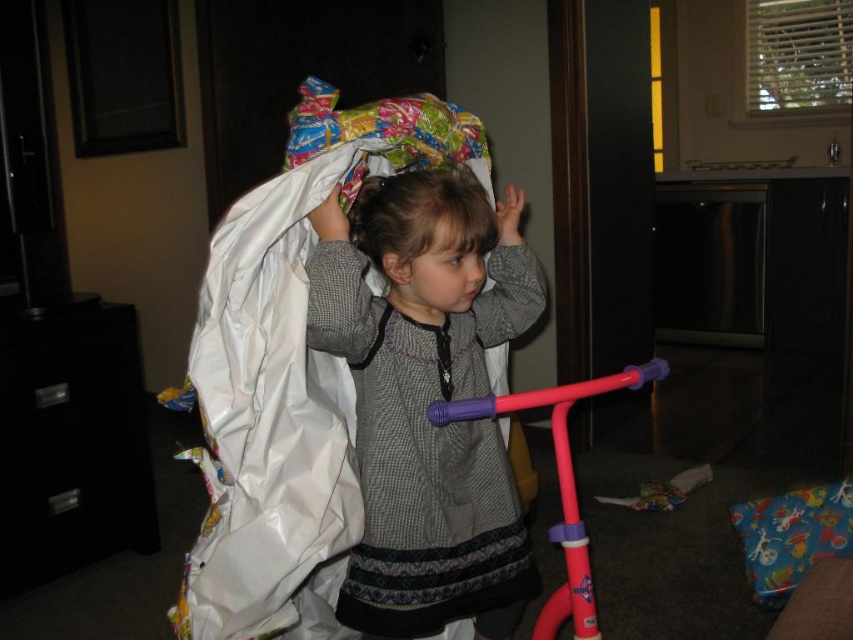
Question: Can you confirm if matte gray sweater at center is wider than smooth gray sweater at center?

Choices:
 (A) yes
 (B) no

Answer: (A)

Question: Among these objects, which one is farthest from the camera?

Choices:
 (A) smooth gray sweater at center
 (B) matte gray sweater at center

Answer: (A)

Question: Which point appears farthest from the camera in this image?

Choices:
 (A) (364, 460)
 (B) (415, 209)

Answer: (A)

Question: Which of the following is the closest to the observer?

Choices:
 (A) smooth gray sweater at center
 (B) matte gray sweater at center

Answer: (B)

Question: Can you confirm if matte gray sweater at center is thinner than smooth gray sweater at center?

Choices:
 (A) no
 (B) yes

Answer: (A)

Question: Is matte gray sweater at center further to the viewer compared to smooth gray sweater at center?

Choices:
 (A) no
 (B) yes

Answer: (A)